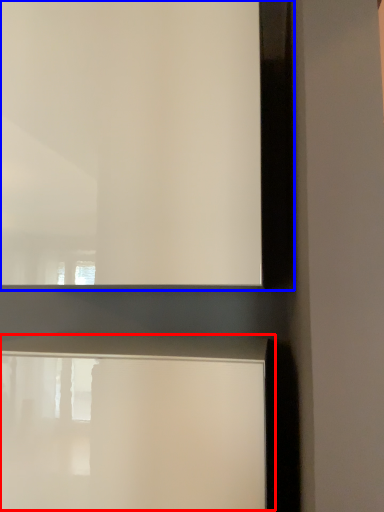
Question: Which object appears farthest to the camera in this image, table (highlighted by a red box) or window frame (highlighted by a blue box)?

Choices:
 (A) table
 (B) window frame

Answer: (B)